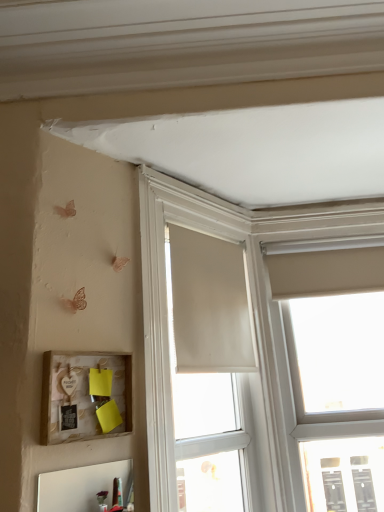
Question: Relative to matte white window at upper right, positioned as the 1th window in right-to-left order, is beige fabric curtain at center in front or behind?

Choices:
 (A) behind
 (B) front

Answer: (B)

Question: From the image's perspective, is beige fabric curtain at center located above or below matte white window at upper right, the 2th window in the left-to-right sequence?

Choices:
 (A) above
 (B) below

Answer: (A)

Question: Which of these objects is positioned farthest from the wooden picture frame at lower left?

Choices:
 (A) matte white window at upper right, positioned as the 1th window in right-to-left order
 (B) matte white window at center, which ranks as the 1th window in left-to-right order
 (C) beige fabric curtain at center

Answer: (A)

Question: Which object is the farthest from the matte white window at center, the second window when ordered from right to left?

Choices:
 (A) wooden picture frame at lower left
 (B) matte white window at upper right, the 2th window in the left-to-right sequence
 (C) beige fabric curtain at center

Answer: (A)